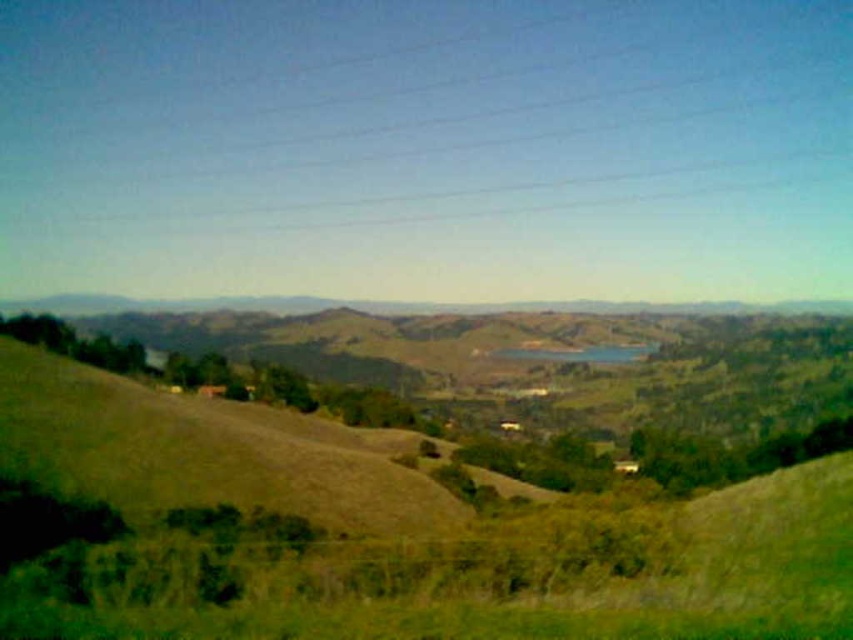
Which is behind, point (560, 616) or point (590, 362)?

Positioned behind is point (590, 362).

Does green grassy hillside at lower center have a larger size compared to blue glass lake at center?

Yes.

Is point (393, 628) more distant than point (546, 352)?

No, (393, 628) is closer to viewer.

Find the location of a particular element. Image resolution: width=853 pixels, height=640 pixels. green grassy hillside at lower center is located at coordinates (572, 592).